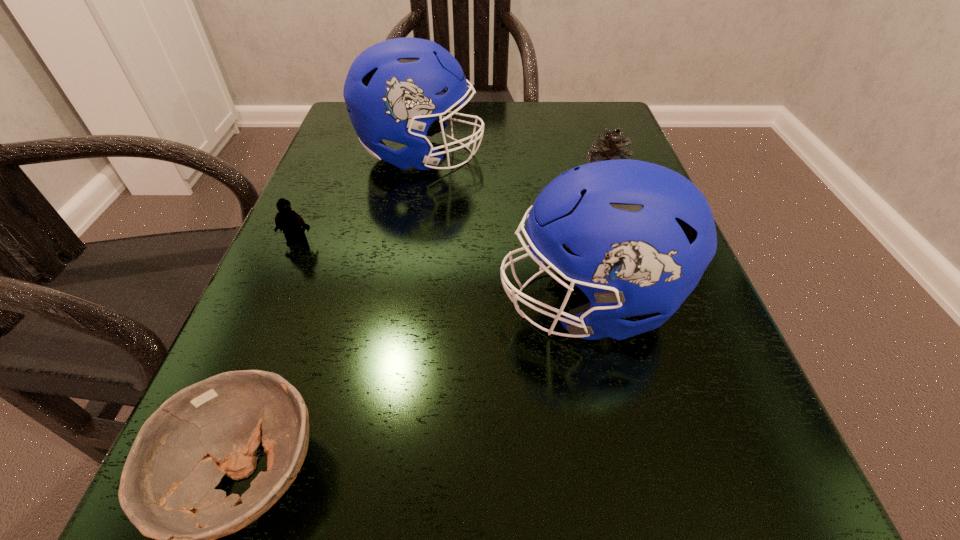
In the image, there is a desktop. Where is `vacant space at the far left corner`? This screenshot has height=540, width=960. vacant space at the far left corner is located at coordinates (348, 119).

In the image, there is a desktop. Where is `vacant space at the far right corner`? vacant space at the far right corner is located at coordinates (587, 131).

Locate an element on the screen. The width and height of the screenshot is (960, 540). vacant area that lies between the third nearest object and the pinecone is located at coordinates (451, 212).

Locate an element on the screen. vacant area that lies between the Lego and the nearer football helmet is located at coordinates (443, 272).

The height and width of the screenshot is (540, 960). I want to click on free space between the left football helmet and the third shortest object, so click(513, 170).

The image size is (960, 540). In order to click on vacant area that lies between the third nearest object and the second nearest object in this screenshot , I will do `click(443, 272)`.

Locate which object is the second closest to the pinecone. Please provide its 2D coordinates. Your answer should be formatted as a tuple, i.e. [(x, y)], where the tuple contains the x and y coordinates of a point satisfying the conditions above.

[(390, 90)]

Find the location of a particular element. The width and height of the screenshot is (960, 540). object identified as the fourth closest to the second nearest object is located at coordinates (293, 226).

Where is `vacant area that satisfies the following two spatial constraints: 1. on the front side of the pinecone; 2. on the front-facing side of the right football helmet`? vacant area that satisfies the following two spatial constraints: 1. on the front side of the pinecone; 2. on the front-facing side of the right football helmet is located at coordinates (646, 303).

Identify the location of blank area in the image that satisfies the following two spatial constraints: 1. on the face guard of the left football helmet; 2. on the face of the Lego. (406, 241).